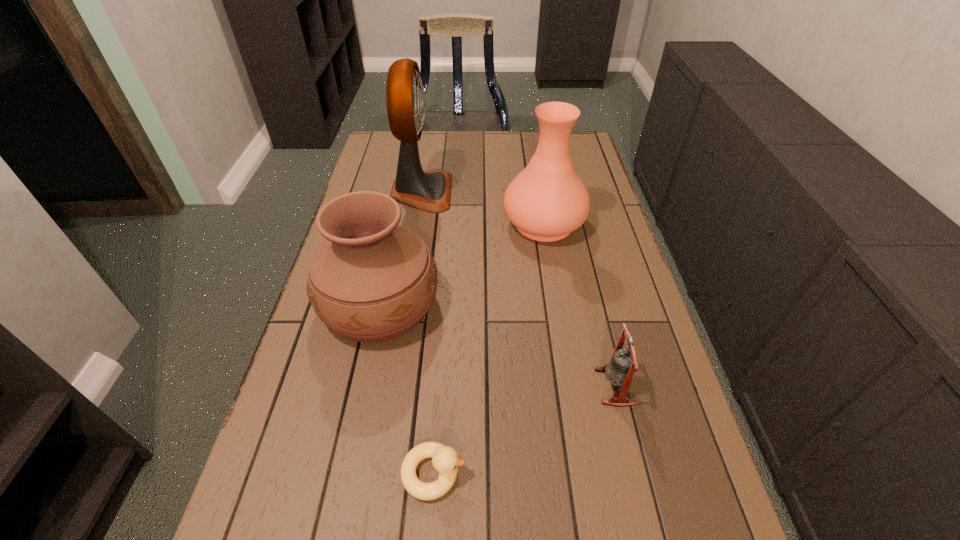
I want to click on object that is the fourth closest to the second tallest object, so click(445, 459).

Find the location of a particular element. vacant position in the image that satisfies the following two spatial constraints: 1. on the front-facing side of the tallest object; 2. on the right side of the fourth shortest object is located at coordinates 417,223.

Where is `free space that satisfies the following two spatial constraints: 1. on the front-facing side of the vase; 2. on the right side of the fan`? free space that satisfies the following two spatial constraints: 1. on the front-facing side of the vase; 2. on the right side of the fan is located at coordinates (417, 223).

At what (x,y) coordinates should I click in order to perform the action: click on vacant region that satisfies the following two spatial constraints: 1. on the front-facing side of the second nearest object; 2. on the right side of the fan. Please return your answer as a coordinate pair (x, y). Looking at the image, I should click on (390, 387).

You are a GUI agent. You are given a task and a screenshot of the screen. Output one action in this format:
    pyautogui.click(x=<x>, y=<y>)
    Task: Click on the vacant space that satisfies the following two spatial constraints: 1. on the front-facing side of the tallest object; 2. on the left side of the vase
    The width and height of the screenshot is (960, 540).
    Given the screenshot: What is the action you would take?
    pyautogui.click(x=417, y=223)

What are the coordinates of `free space that satisfies the following two spatial constraints: 1. on the front-facing side of the fan; 2. on the right side of the bell` in the screenshot? It's located at (390, 387).